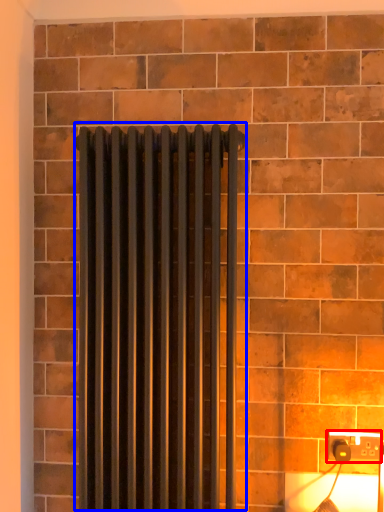
Question: Among these objects, which one is nearest to the camera, power plugs and sockets (highlighted by a red box) or radiator (highlighted by a blue box)?

Choices:
 (A) power plugs and sockets
 (B) radiator

Answer: (B)